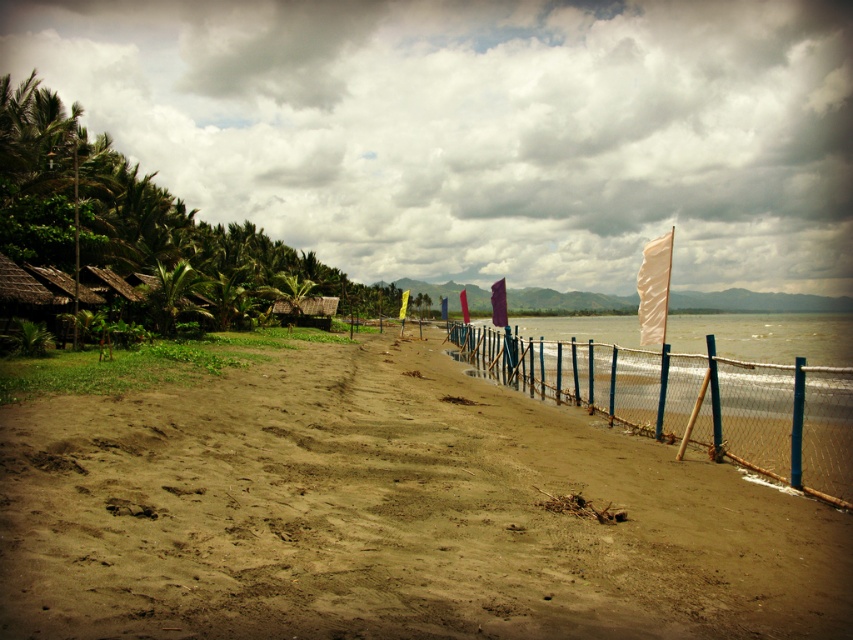
Is brown sandy dirt field at center below translucent plastic water at center?

Yes.

Who is lower down, brown sandy dirt field at center or translucent plastic water at center?

Positioned lower is brown sandy dirt field at center.

Does point (489, 621) come closer to viewer compared to point (543, 321)?

Yes, it is in front of point (543, 321).

What are the coordinates of `brown sandy dirt field at center` in the screenshot? It's located at (389, 515).

Is point (775, 468) more distant than point (788, 355)?

That is False.

Which is in front, point (811, 420) or point (514, 323)?

Point (811, 420)

Is point (743, 416) less distant than point (680, 340)?

That is True.

The height and width of the screenshot is (640, 853). Identify the location of blue wire mesh fence at center. (693, 401).

Who is higher up, brown sandy dirt field at center or blue wire mesh fence at center?

blue wire mesh fence at center is higher up.

The image size is (853, 640). Describe the element at coordinates (389, 515) in the screenshot. I see `brown sandy dirt field at center` at that location.

Locate an element on the screen. brown sandy dirt field at center is located at coordinates (389, 515).